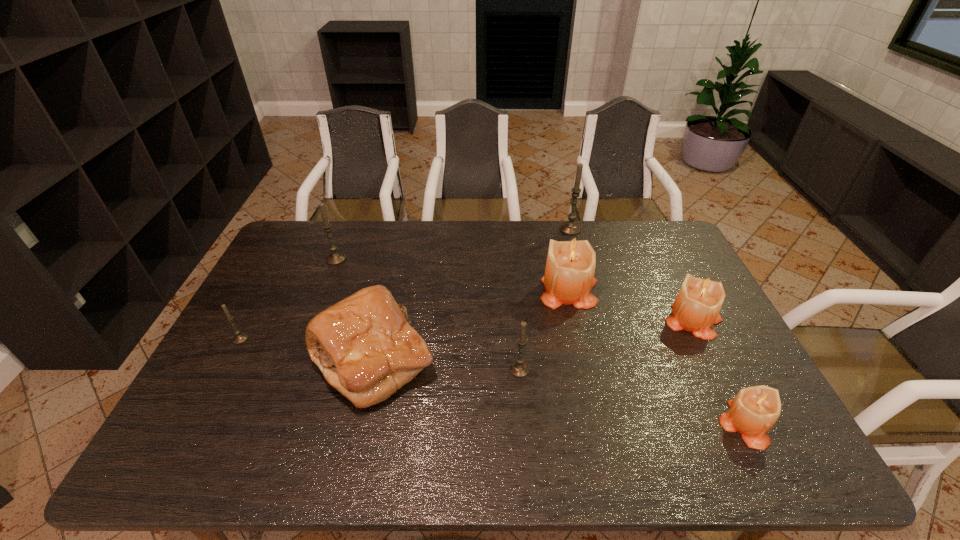
This screenshot has width=960, height=540. I want to click on the biggest gray candle, so click(571, 227).

Locate an element on the screen. This screenshot has height=540, width=960. the farthest object is located at coordinates (571, 227).

The width and height of the screenshot is (960, 540). I want to click on the second biggest gray candle, so click(334, 258).

Image resolution: width=960 pixels, height=540 pixels. Identify the location of the second gray candle from left to right. (334, 258).

Locate an element on the screen. The height and width of the screenshot is (540, 960). the biggest beige candle is located at coordinates (569, 277).

Find the location of a particular element. This screenshot has height=540, width=960. the third gray candle from left to right is located at coordinates (519, 368).

In order to click on the fifth candle from right to left in this screenshot , I will do `click(519, 368)`.

I want to click on the sixth object from right to left, so click(x=364, y=346).

Locate an element on the screen. The height and width of the screenshot is (540, 960). brownish-beige bread is located at coordinates (364, 346).

At what (x,y) coordinates should I click in order to perform the action: click on the second biggest beige candle. Please return your answer as a coordinate pair (x, y). This screenshot has width=960, height=540. Looking at the image, I should click on (696, 308).